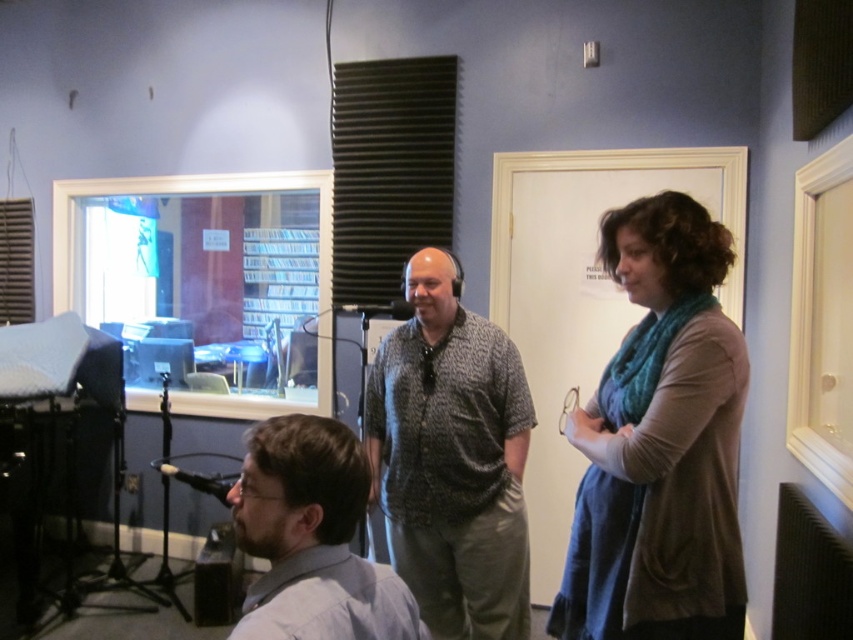
You are a photographer positioned at the center of the room. You want to take a photo of the teal knit scarf at right. Which direction should you move to get a better shot?

The teal knit scarf at right is located at point 0.692 on the x axis and 0.775 on the y axis. Since you are at the center, you should move to the right and slightly upwards to align with the scarf.

Looking at this image, please look at the point at coordinates (x=451, y=458). What object is located there?

The patterned fabric shirt at center is located at point (x=451, y=458).

You are a photographer positioned in the studio and need to capture a photo of both the teal knit scarf at right and the gray shirt at lower left in the same frame. Based on their positions, which object should you focus on first to ensure both are in the frame?

The teal knit scarf at right is located above the gray shirt at lower left, so you should focus on the gray shirt at lower left first to ensure both are within the frame.